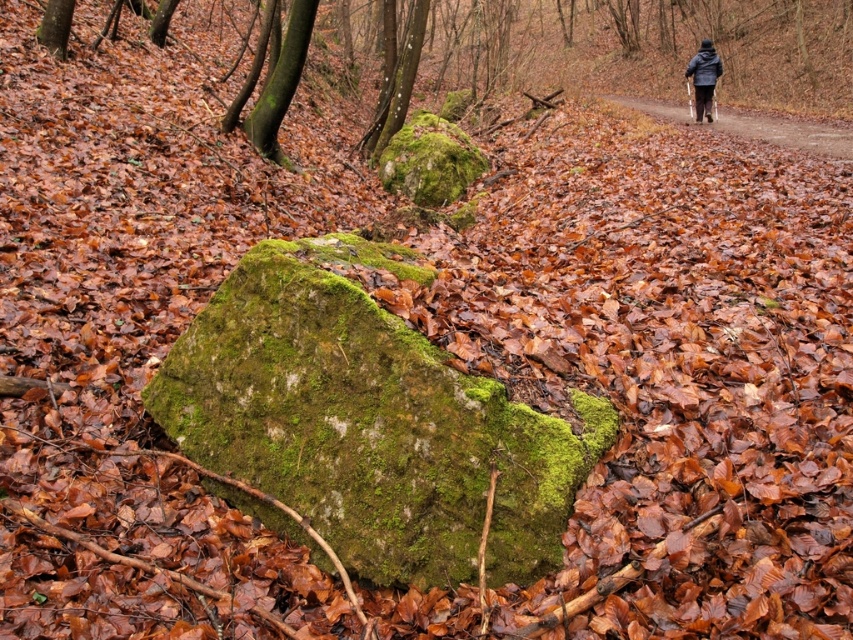
Question: Which of the following is the closest to the observer?

Choices:
 (A) brown dirt path at center
 (B) green mossy rock at center
 (C) dark blue jacket at upper right

Answer: (B)

Question: Does brown dirt path at center appear over dark blue jacket at upper right?

Choices:
 (A) yes
 (B) no

Answer: (B)

Question: Which point is farther to the camera?

Choices:
 (A) brown dirt path at center
 (B) dark blue jacket at upper right

Answer: (B)

Question: Which object is farther from the camera taking this photo?

Choices:
 (A) brown dirt path at center
 (B) dark blue jacket at upper right

Answer: (B)

Question: Does green mossy rock at center have a larger size compared to dark blue jacket at upper right?

Choices:
 (A) yes
 (B) no

Answer: (A)

Question: Is brown dirt path at center further to camera compared to dark blue jacket at upper right?

Choices:
 (A) no
 (B) yes

Answer: (A)